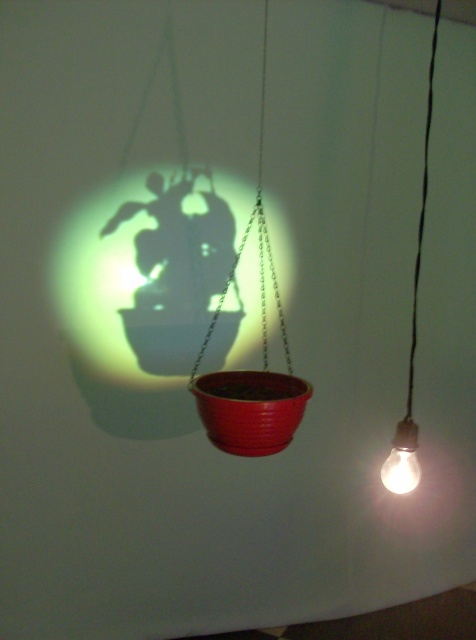
Question: Which is nearer to the matte plastic plant at center?

Choices:
 (A) matte white bulb at right
 (B) matte white bulb at lower right

Answer: (A)

Question: Does matte plastic plant at center lie behind matte white bulb at lower right?

Choices:
 (A) yes
 (B) no

Answer: (A)

Question: Is matte plastic plant at center smaller than matte white bulb at lower right?

Choices:
 (A) yes
 (B) no

Answer: (B)

Question: Which point appears closest to the camera in this image?

Choices:
 (A) (414, 467)
 (B) (393, 456)

Answer: (A)

Question: Is matte white bulb at right bigger than matte white bulb at lower right?

Choices:
 (A) yes
 (B) no

Answer: (A)

Question: Which object is the farthest from the matte white bulb at lower right?

Choices:
 (A) matte white bulb at right
 (B) matte plastic plant at center

Answer: (B)